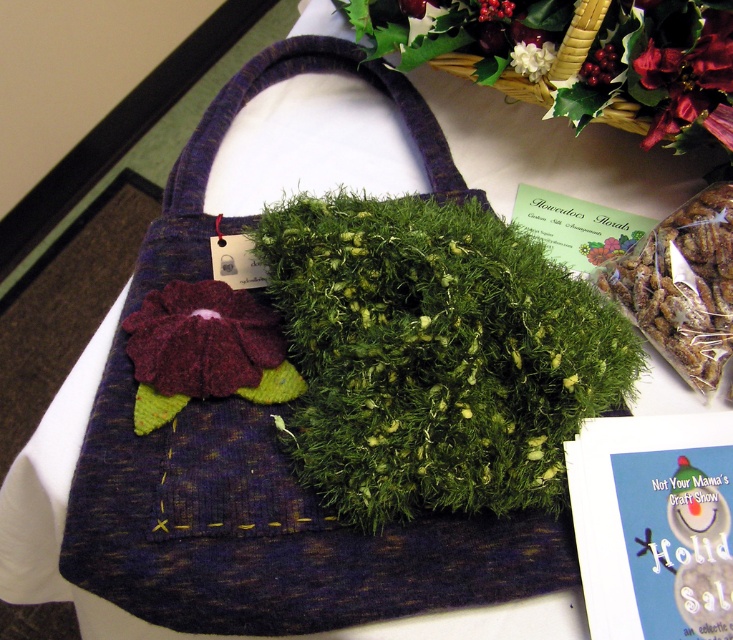
You are an artist trying to paint the scene. You need to decide which object to paint first based on their height. Which one should you start with, the shiny brown nuts at upper right or the green fuzzy flower at upper center?

The shiny brown nuts at upper right is much taller than the green fuzzy flower at upper center, so you should start painting the shiny brown nuts at upper right first to ensure proper perspective and layering.

You are at a craft fair and see the shiny brown nuts at upper right and the green fuzzy flower at upper center on a display table. Which item is positioned lower on the table?

The shiny brown nuts at upper right is located below green fuzzy flower at upper center, so it is positioned lower on the table.